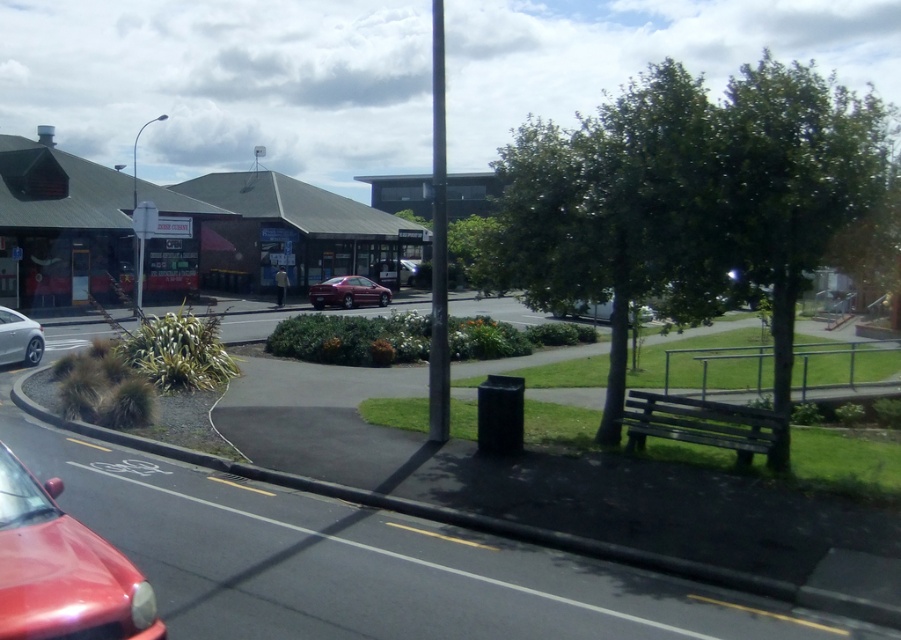
Measure the distance from shiny red car at lower left to shiny red car at center.

shiny red car at lower left and shiny red car at center are 34.69 meters apart from each other.

The width and height of the screenshot is (901, 640). What do you see at coordinates (62, 570) in the screenshot?
I see `shiny red car at lower left` at bounding box center [62, 570].

Identify the location of shiny red car at lower left. (62, 570).

Does shiny red car at lower left appear on the left side of silver metallic sedan at left?

No, shiny red car at lower left is not to the left of silver metallic sedan at left.

This screenshot has height=640, width=901. What are the coordinates of `shiny red car at lower left` in the screenshot? It's located at (62, 570).

Does point (140, 605) lie in front of point (33, 355)?

Yes, point (140, 605) is closer to viewer.

You are a GUI agent. You are given a task and a screenshot of the screen. Output one action in this format:
    pyautogui.click(x=<x>, y=<y>)
    Task: Click on the shiny red car at lower left
    The width and height of the screenshot is (901, 640).
    Given the screenshot: What is the action you would take?
    pyautogui.click(x=62, y=570)

Does point (32, 531) lie in front of point (405, 272)?

Yes, point (32, 531) is closer to viewer.

How much distance is there between shiny red car at lower left and matte red car at center?

The distance of shiny red car at lower left from matte red car at center is 47.37 meters.

Locate an element on the screen. This screenshot has width=901, height=640. shiny red car at lower left is located at coordinates 62,570.